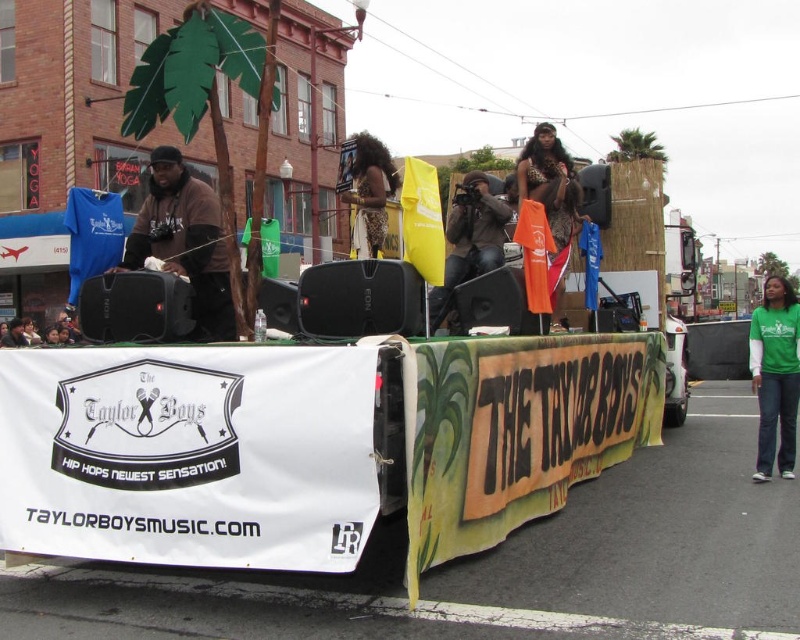
Is the position of green cotton shirt at lower right less distant than that of leather jacket at upper center?

No, green cotton shirt at lower right is behind leather jacket at upper center.

Is green cotton shirt at lower right taller than leather jacket at upper center?

Incorrect, green cotton shirt at lower right's height is not larger of leather jacket at upper center's.

Does point (798, 336) come in front of point (544, 179)?

Yes.

At what (x,y) coordinates should I click in order to perform the action: click on green cotton shirt at lower right. Please return your answer as a coordinate pair (x, y). This screenshot has width=800, height=640. Looking at the image, I should click on (776, 376).

Does brown matte/black textured jacket at left have a smaller size compared to leather jacket at upper center?

Indeed, brown matte/black textured jacket at left has a smaller size compared to leather jacket at upper center.

Looking at this image, is brown matte/black textured jacket at left thinner than leather jacket at upper center?

Yes, brown matte/black textured jacket at left is thinner than leather jacket at upper center.

Is point (156, 179) in front of point (544, 131)?

Yes, point (156, 179) is in front of point (544, 131).

Where is `brown matte/black textured jacket at left`? brown matte/black textured jacket at left is located at coordinates (186, 241).

Is matte black camera at center bigger than leopard print dress at center?

Incorrect, matte black camera at center is not larger than leopard print dress at center.

Which is behind, point (472, 237) or point (366, 184)?

Point (366, 184)

What do you see at coordinates (470, 241) in the screenshot? I see `matte black camera at center` at bounding box center [470, 241].

The image size is (800, 640). What are the coordinates of `matte black camera at center` in the screenshot? It's located at (470, 241).